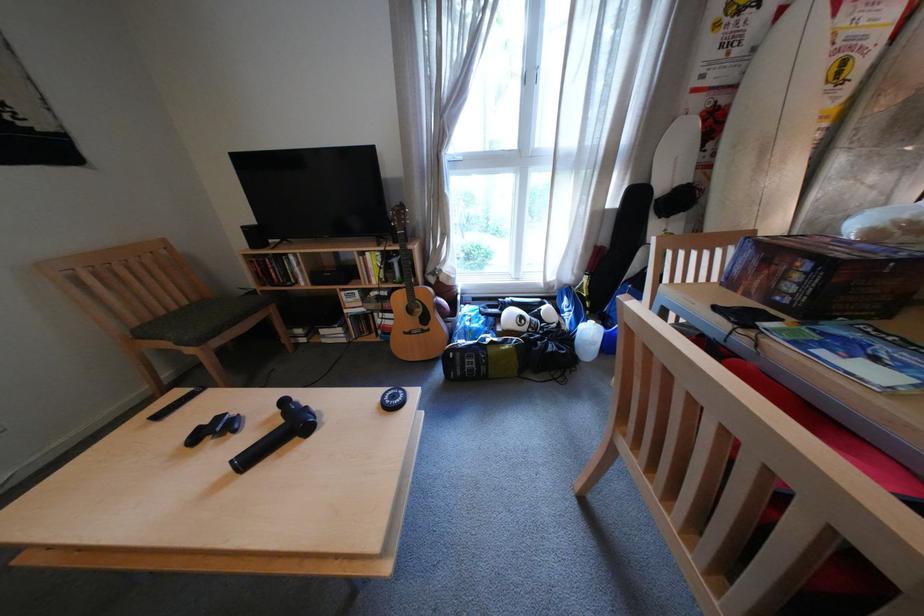
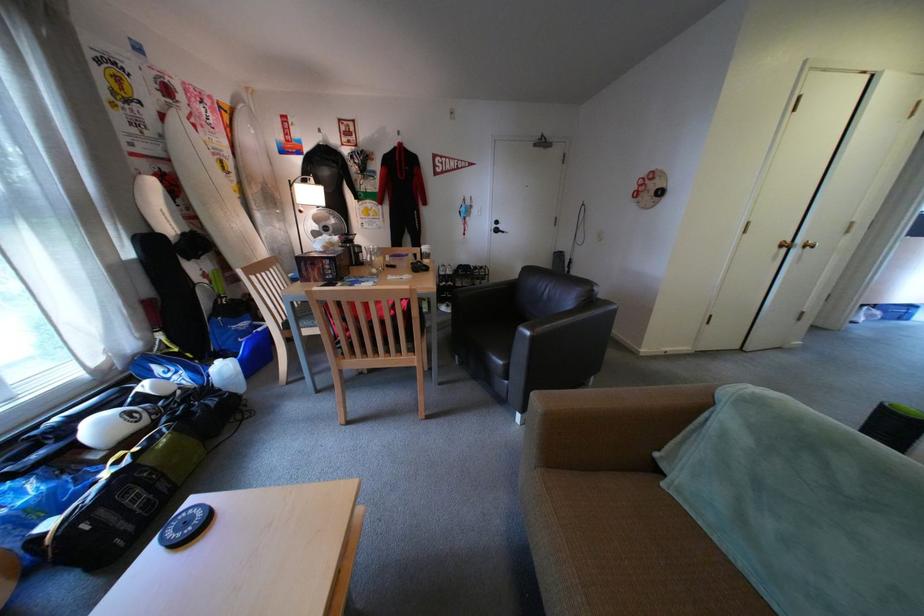
The point at (604, 323) is marked in the first image. Where is the corresponding point in the second image?

(233, 363)